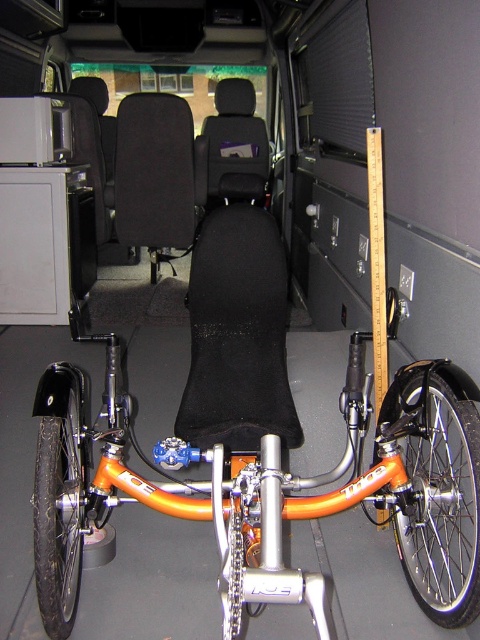
Is orange metallic bicycle at center closer to camera compared to black fabric seat at center?

Yes.

What are the coordinates of `orange metallic bicycle at center` in the screenshot? It's located at (269, 488).

Between point (177, 468) and point (238, 328), which one is positioned in front?

Point (177, 468) is more forward.

This screenshot has width=480, height=640. What are the coordinates of `orange metallic bicycle at center` in the screenshot? It's located at (269, 488).

Who is more distant from viewer, (375, 472) or (45, 436)?

The point (375, 472) is more distant.

Is point (417, 536) farther from camera compared to point (44, 444)?

Yes.

Between point (423, 552) and point (35, 515), which one is positioned in front?

Point (35, 515) is in front.

Image resolution: width=480 pixels, height=640 pixels. What are the coordinates of `orange metallic bicycle at center` in the screenshot? It's located at (269, 488).

Between orange metallic bicycle at center and orange metallic/reflective wheel at lower right, which one appears on the right side from the viewer's perspective?

Positioned to the right is orange metallic/reflective wheel at lower right.

Does orange metallic bicycle at center appear on the right side of orange metallic/reflective wheel at lower right?

Incorrect, orange metallic bicycle at center is not on the right side of orange metallic/reflective wheel at lower right.

Image resolution: width=480 pixels, height=640 pixels. What do you see at coordinates (269, 488) in the screenshot?
I see `orange metallic bicycle at center` at bounding box center [269, 488].

Where is `orange metallic bicycle at center`? orange metallic bicycle at center is located at coordinates (269, 488).